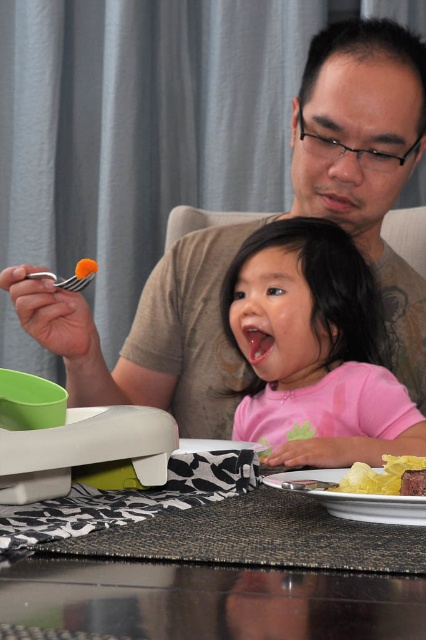
Question: Is pink matte shirt at center thinner than silver metallic fork at upper left?

Choices:
 (A) yes
 (B) no

Answer: (B)

Question: Can you confirm if pink matte shirt at center is positioned to the left of white glossy plate at lower center?

Choices:
 (A) no
 (B) yes

Answer: (B)

Question: Which of these objects is positioned farthest from the pink matte shirt at center?

Choices:
 (A) black textured placemat at lower center
 (B) white glossy plate at lower center

Answer: (B)

Question: Where is pink matte shirt at center located in relation to white glossy plate at lower center in the image?

Choices:
 (A) left
 (B) right

Answer: (A)

Question: Estimate the real-world distances between objects in this image. Which object is closer to the white glossy plate at lower center?

Choices:
 (A) matte brown shirt at upper center
 (B) pink matte shirt at center
 (C) yellow crispy chips at lower right
 (D) silver metallic fork at upper left

Answer: (C)

Question: Which object appears closest to the camera in this image?

Choices:
 (A) white glossy plate at lower center
 (B) yellow crispy chips at lower right
 (C) matte brown shirt at upper center
 (D) black textured placemat at lower center

Answer: (D)